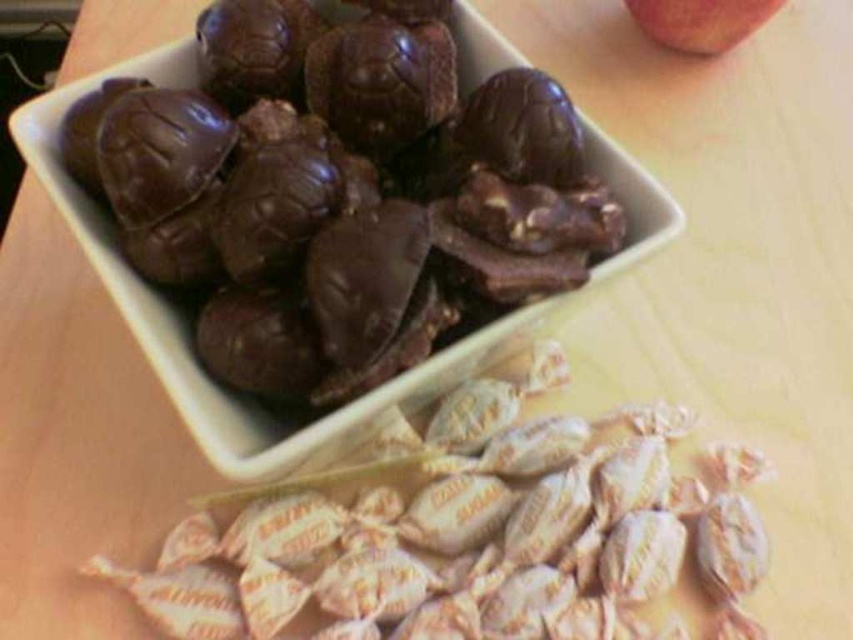
Question: Estimate the real-world distances between objects in this image. Which object is farther from the white paper wrapped candy at lower center?

Choices:
 (A) shiny chocolate candies at upper center
 (B) red matte apple at upper right

Answer: (B)

Question: Is shiny chocolate candies at upper center smaller than white paper wrapped candy at lower center?

Choices:
 (A) yes
 (B) no

Answer: (B)

Question: Considering the relative positions of shiny chocolate candies at upper center and red matte apple at upper right in the image provided, where is shiny chocolate candies at upper center located with respect to red matte apple at upper right?

Choices:
 (A) above
 (B) below

Answer: (B)

Question: Is shiny chocolate candies at upper center to the left of red matte apple at upper right from the viewer's perspective?

Choices:
 (A) no
 (B) yes

Answer: (B)

Question: Which point is farther to the camera?

Choices:
 (A) (732, 35)
 (B) (281, 228)

Answer: (A)

Question: Which point is farther from the camera taking this photo?

Choices:
 (A) (712, 17)
 (B) (323, 609)
 (C) (366, 316)

Answer: (A)